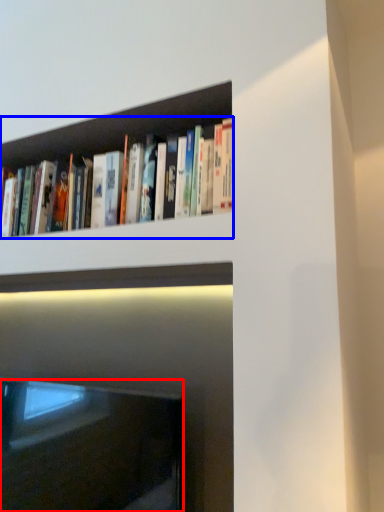
Question: Which object is further to the camera taking this photo, fireplace (highlighted by a red box) or book (highlighted by a blue box)?

Choices:
 (A) fireplace
 (B) book

Answer: (A)